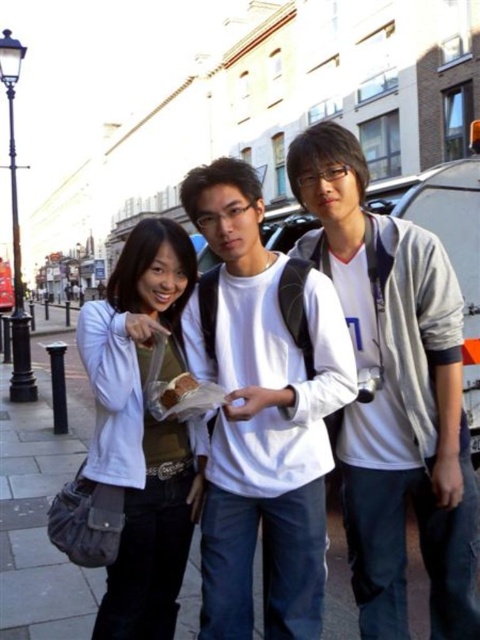
You are standing at the scene and want to hand a document to both the white matte jacket at center and the white cotton shirt at center. Which one should you approach first if you want to minimize the total distance walked?

You should approach the white cotton shirt at center first because the white matte jacket at center is 4.84 meters away from the white cotton shirt at center, so starting with the closer one reduces the total distance walked.

You are a photographer trying to capture a photo of the two people wearing white at the center of the scene. Since they are standing close to each other, you want to ensure you can distinguish between the white matte jacket at center and the white cotton shirt at center in your photo. Which one is positioned to the right of the other?

The white matte jacket at center is positioned on the right side of white cotton shirt at center, so it is to the right of the white cotton shirt at center.